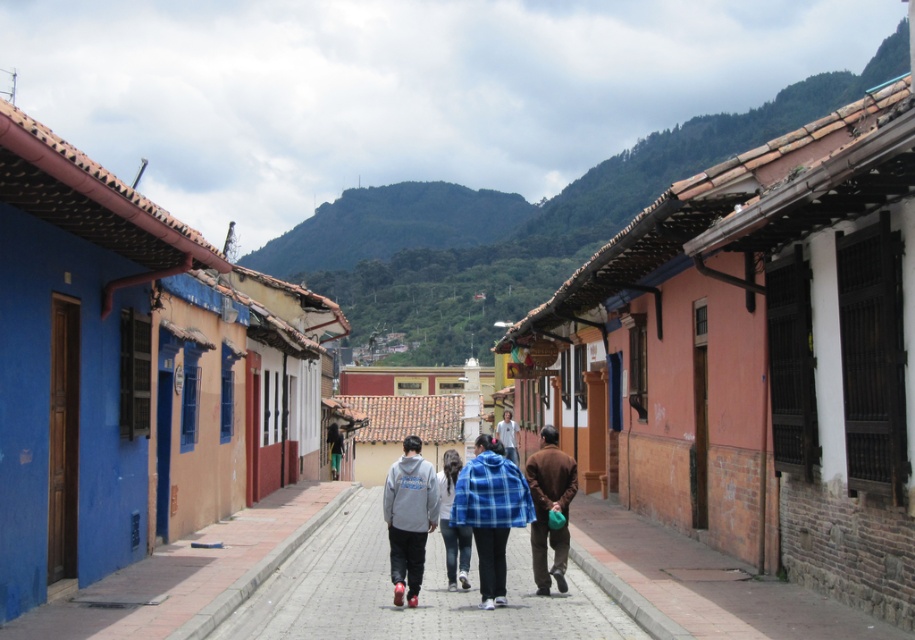
Who is lower down, blue painted wall at lower left or blue plaid jacket at center?

Positioned lower is blue painted wall at lower left.

Find the location of a particular element. blue painted wall at lower left is located at coordinates (189, 573).

Who is lower down, matte gray hoodie at center or brown matte jacket at center?

matte gray hoodie at center is below.

Is point (427, 468) farther from camera compared to point (529, 474)?

No, it is in front of (529, 474).

Who is more distant from viewer, (395, 529) or (558, 570)?

The point (558, 570) is more distant.

Where is `matte gray hoodie at center`? Image resolution: width=915 pixels, height=640 pixels. matte gray hoodie at center is located at coordinates click(x=408, y=516).

Which is more to the left, brick pavement at lower center or light gray hoodie at center?

light gray hoodie at center is more to the left.

Between point (650, 541) and point (506, 449), which one is positioned in front?

Positioned in front is point (650, 541).

This screenshot has height=640, width=915. What are the coordinates of `brick pavement at lower center` in the screenshot? It's located at (709, 582).